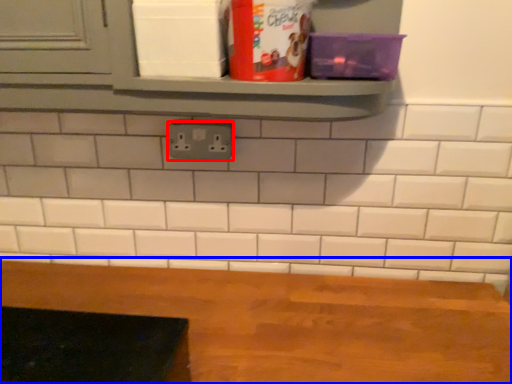
Question: Which object appears farthest to the camera in this image, electric outlet (highlighted by a red box) or table (highlighted by a blue box)?

Choices:
 (A) electric outlet
 (B) table

Answer: (A)